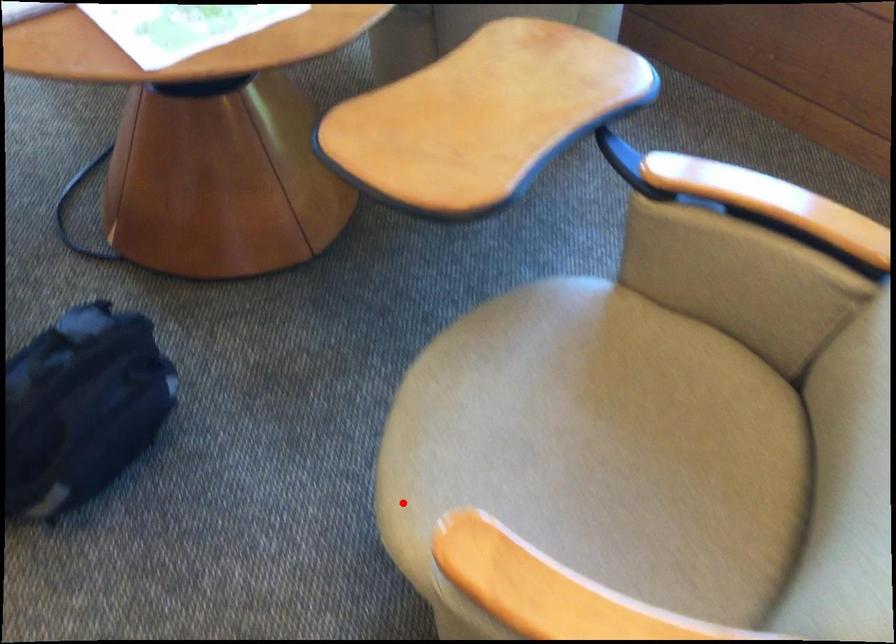
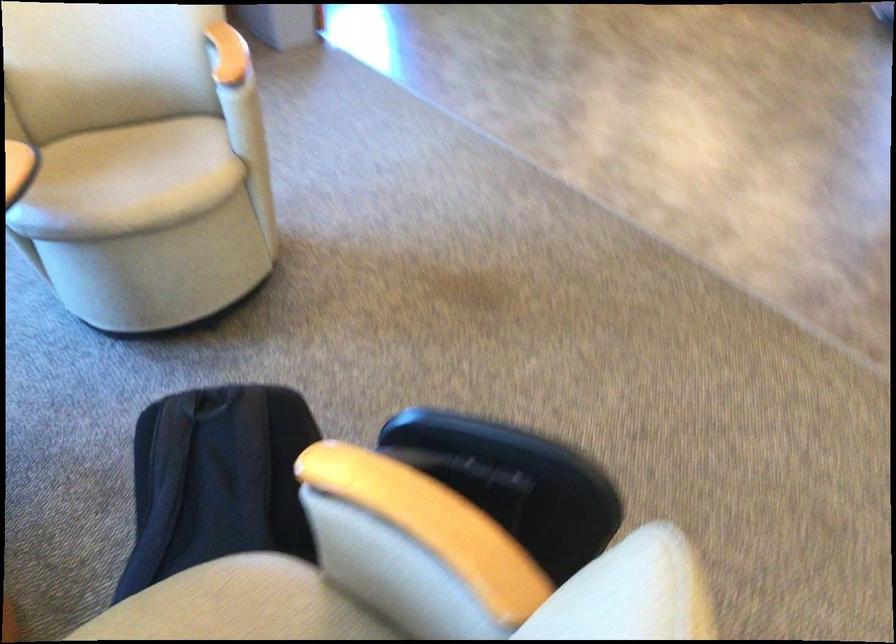
Question: I am providing you with two images of the same scene from different viewpoints. Given a red point in image1, look at the same physical point in image2. Is it:

Choices:
 (A) Closer to the viewpoint
 (B) Farther from the viewpoint

Answer: (B)